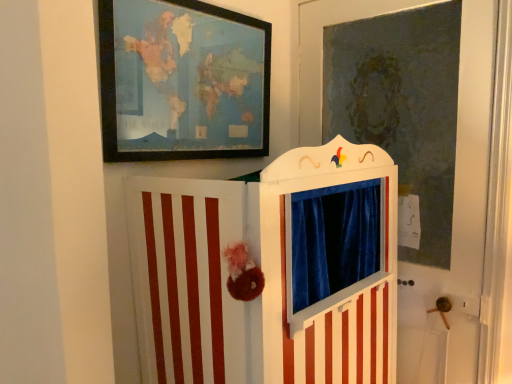
Question: From a real-world perspective, relative to white striped puppet theater at center, is wooden framed map at upper left vertically above or below?

Choices:
 (A) above
 (B) below

Answer: (A)

Question: In the image, is wooden framed map at upper left on the left side or the right side of white striped puppet theater at center?

Choices:
 (A) left
 (B) right

Answer: (A)

Question: Estimate the real-world distances between objects in this image. Which object is farther from the white striped puppet theater at center?

Choices:
 (A) velvet blue curtain at upper center
 (B) wooden framed map at upper left

Answer: (A)

Question: Considering the real-world distances, which object is farthest from the white striped puppet theater at center?

Choices:
 (A) velvet blue curtain at upper center
 (B) wooden framed map at upper left

Answer: (A)